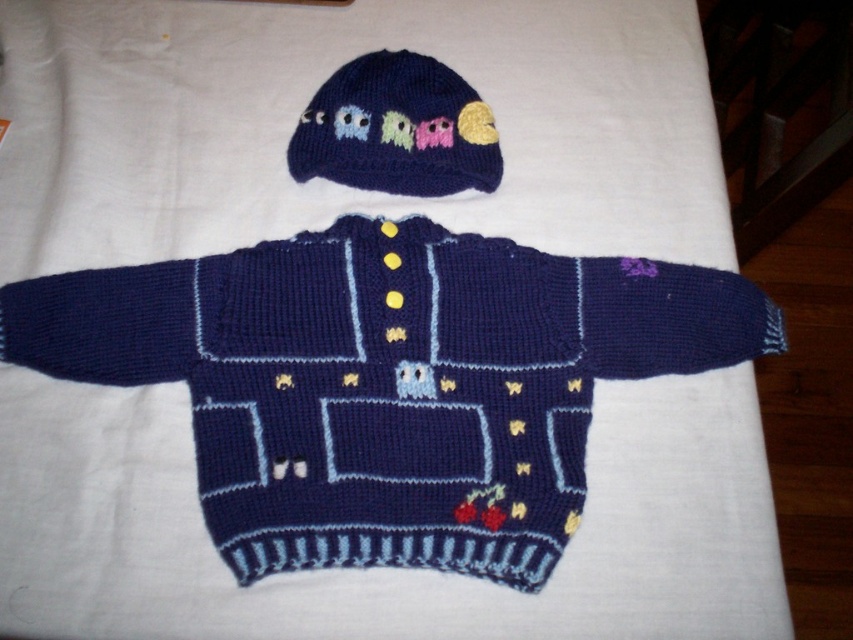
Question: Is navy blue knitted sweater at center below knitted dark blue hat at upper center?

Choices:
 (A) yes
 (B) no

Answer: (A)

Question: Can you confirm if navy blue knitted sweater at center is thinner than knitted dark blue hat at upper center?

Choices:
 (A) yes
 (B) no

Answer: (B)

Question: Which point appears closest to the camera in this image?

Choices:
 (A) (442, 129)
 (B) (347, 529)

Answer: (B)

Question: Can you confirm if navy blue knitted sweater at center is positioned to the left of knitted dark blue hat at upper center?

Choices:
 (A) no
 (B) yes

Answer: (A)

Question: Which point is closer to the camera taking this photo?

Choices:
 (A) (474, 528)
 (B) (314, 147)

Answer: (A)